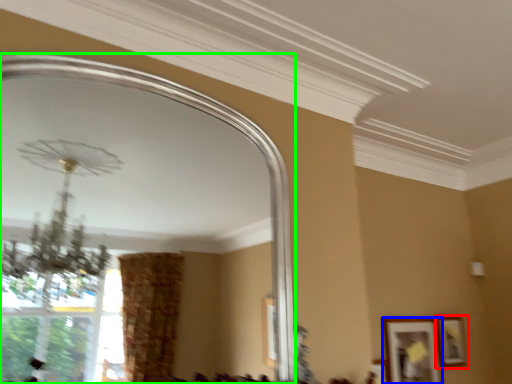
Question: Which is farther away from picture frame (highlighted by a red box)? picture frame (highlighted by a blue box) or mirror (highlighted by a green box)?

Choices:
 (A) picture frame
 (B) mirror

Answer: (B)